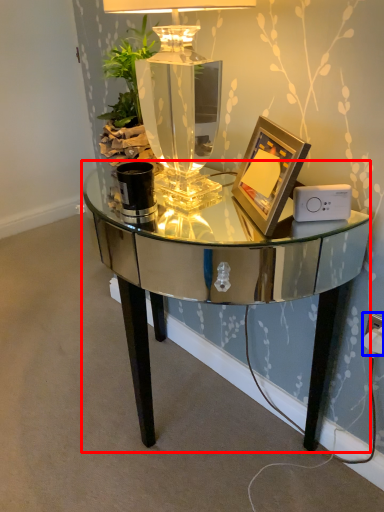
Question: Which point is closer to the camera, table (highlighted by a red box) or electric outlet (highlighted by a blue box)?

Choices:
 (A) table
 (B) electric outlet

Answer: (A)